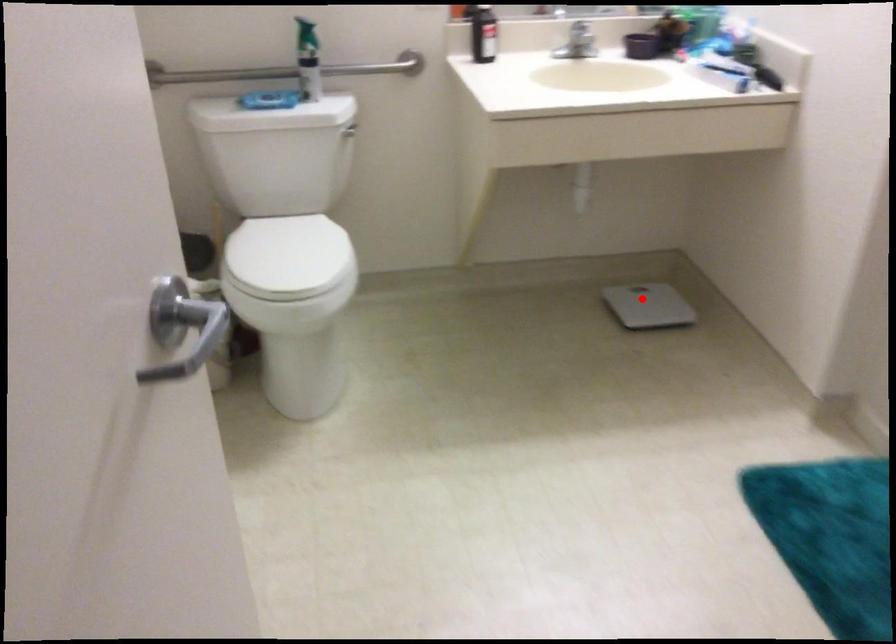
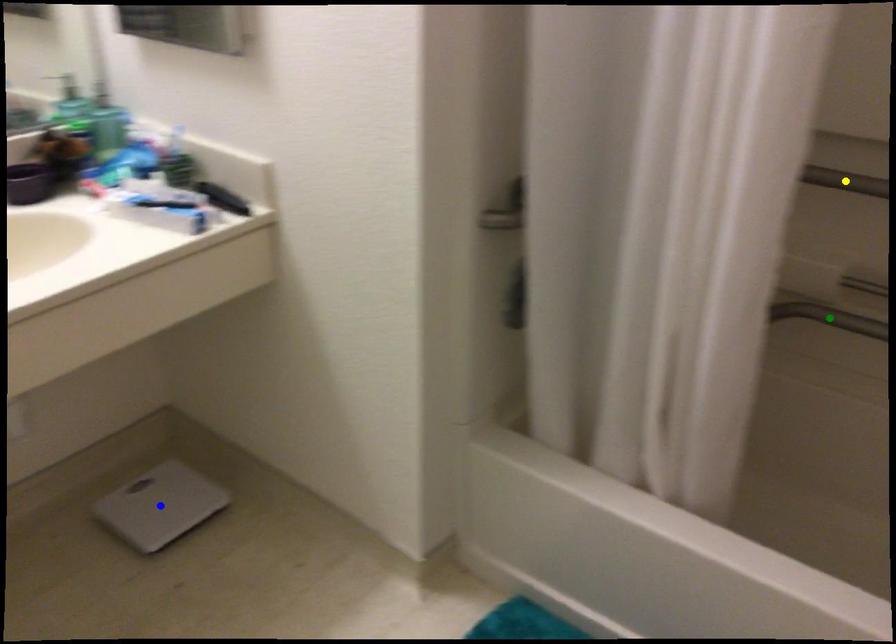
Question: I am providing you with two images of the same scene from different viewpoints. A red point is marked on the first image. You are given multiple points on the second image. Which point in image 2 represents the same 3d spot as the red point in image 1?

Choices:
 (A) yellow point
 (B) blue point
 (C) green point

Answer: (B)